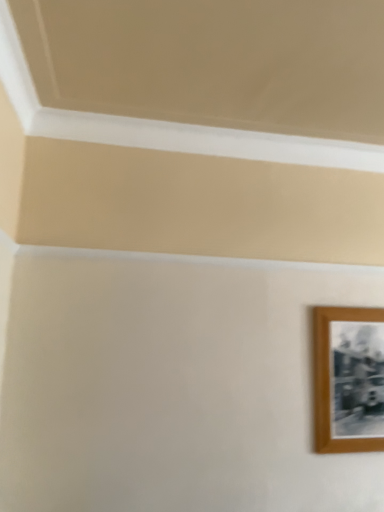
Measure the distance between wooden photo frame at lower right and camera.

The depth of wooden photo frame at lower right is 1.82 meters.

You are a GUI agent. You are given a task and a screenshot of the screen. Output one action in this format:
    pyautogui.click(x=<x>, y=<y>)
    Task: Click on the wooden photo frame at lower right
    
    Given the screenshot: What is the action you would take?
    pyautogui.click(x=348, y=379)

Describe the element at coordinates (348, 379) in the screenshot. I see `wooden photo frame at lower right` at that location.

Find the location of a particular element. The image size is (384, 512). wooden photo frame at lower right is located at coordinates (348, 379).